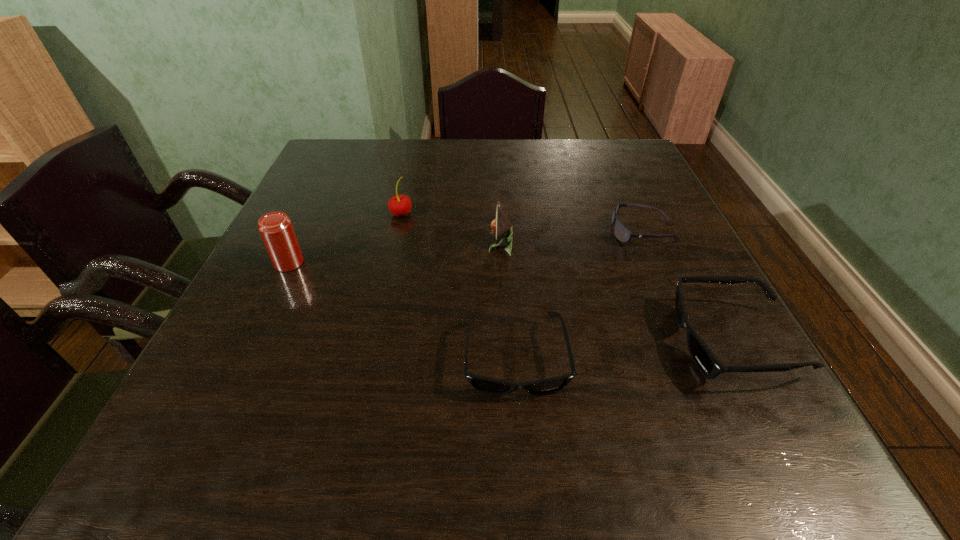
At what (x,y) coordinates should I click in order to perform the action: click on object present at the near right corner. Please return your answer as a coordinate pair (x, y). Looking at the image, I should click on (708, 364).

Locate an element on the screen. vacant space at the far edge of the desktop is located at coordinates (396, 161).

Identify the location of blank space at the near edge of the desktop. This screenshot has width=960, height=540. (305, 386).

Find the location of `free space at the left edge of the desktop`. free space at the left edge of the desktop is located at coordinates (230, 308).

In order to click on blank space at the right edge in this screenshot , I will do `click(641, 249)`.

You are a GUI agent. You are given a task and a screenshot of the screen. Output one action in this format:
    pyautogui.click(x=<x>, y=<y>)
    Task: Click on the vacant space at the near left corner of the desktop
    Image resolution: width=960 pixels, height=540 pixels.
    Given the screenshot: What is the action you would take?
    pyautogui.click(x=238, y=366)

This screenshot has height=540, width=960. I want to click on free space at the near right corner of the desktop, so click(x=689, y=364).

Identify the location of vacant area that lies between the avocado and the shortest sunglasses. The height and width of the screenshot is (540, 960). (571, 238).

This screenshot has width=960, height=540. In order to click on free area in between the second shortest object and the avocado in this screenshot , I will do `click(508, 302)`.

The height and width of the screenshot is (540, 960). I want to click on empty space that is in between the avocado and the fifth object from right to left, so click(450, 230).